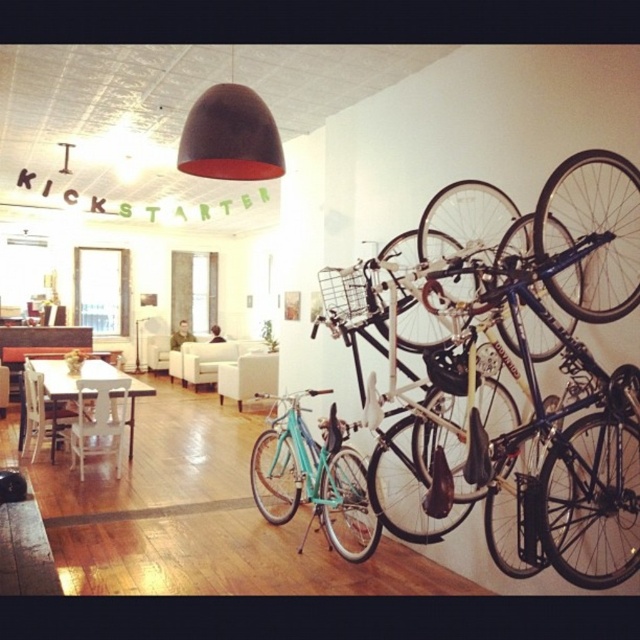
You are standing at the entrance of the room and want to find the teal matte bicycle at right. According to the spatial coordinates provided, where should you look relative to the dining table?

The teal matte bicycle at right is located at coordinates point (518, 376), which places it to the right side of the dining table.

You are trying to decide where to place a new plant stand that must be smaller than both the teal matte bicycle at center and the white wooden table at center. Based on the scene, which object should the plant stand be smaller than?

The plant stand must be smaller than both the teal matte bicycle at center and the white wooden table at center. Since the teal matte bicycle at center is smaller than the white wooden table at center, the plant stand needs to be smaller than the teal matte bicycle at center to satisfy both conditions.